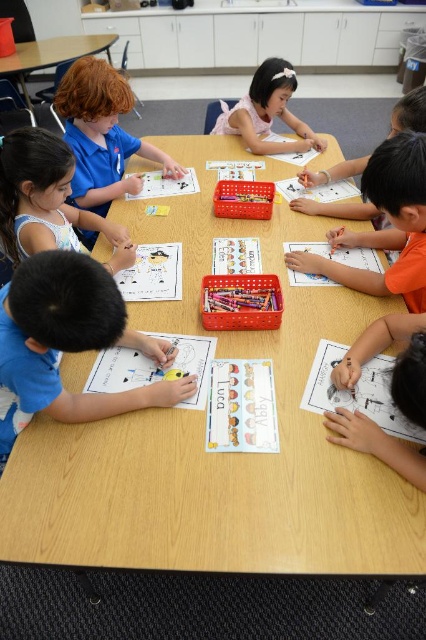
You are a teacher in the classroom. You notice two children wearing blue shirts. One is wearing a matte blue shirt at left and the other a blue shirt at upper left. Which child is positioned more to the left side of the table?

The matte blue shirt at left is positioned more to the left of the table compared to the blue shirt at upper left.